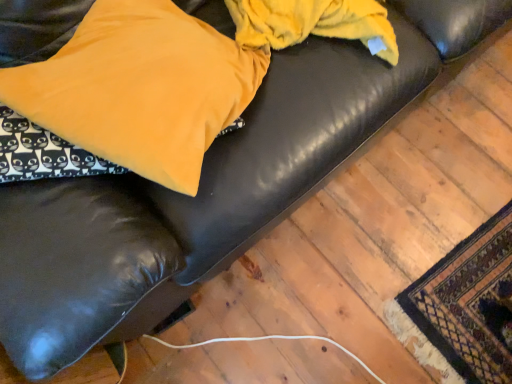
What do you see at coordinates (140, 88) in the screenshot?
I see `matte yellow pillow at upper left` at bounding box center [140, 88].

Where is `matte yellow pillow at upper left`? matte yellow pillow at upper left is located at coordinates (140, 88).

From the picture: Measure the distance between matte yellow pillow at upper left and camera.

A distance of 30.08 inches exists between matte yellow pillow at upper left and camera.

Locate an element on the screen. This screenshot has height=384, width=512. matte yellow pillow at upper left is located at coordinates (140, 88).